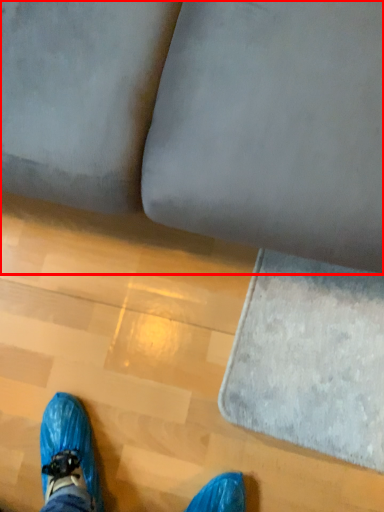
Question: From the image's perspective, where is studio couch (annotated by the red box) located relative to mat?

Choices:
 (A) below
 (B) above

Answer: (B)